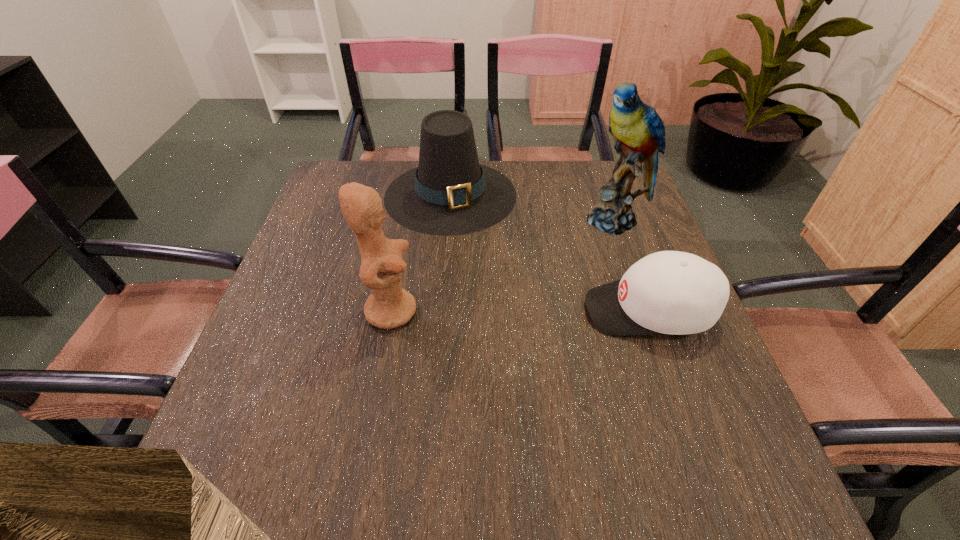
This screenshot has height=540, width=960. In order to click on vacant space located on the face of the parrot in this screenshot , I will do `click(567, 279)`.

Image resolution: width=960 pixels, height=540 pixels. I want to click on free location located on the front-facing side of the third tallest object, so click(x=469, y=261).

Locate an element on the screen. vacant area situated on the front-facing side of the third tallest object is located at coordinates (480, 296).

At what (x,y) coordinates should I click in order to perform the action: click on vacant space situated 0.090m on the front-facing side of the third tallest object. Please return your answer as a coordinate pair (x, y). Looking at the image, I should click on (468, 258).

You are a GUI agent. You are given a task and a screenshot of the screen. Output one action in this format:
    pyautogui.click(x=<x>, y=<y>)
    Task: Click on the parrot located at the far edge
    
    Given the screenshot: What is the action you would take?
    pyautogui.click(x=638, y=131)

The width and height of the screenshot is (960, 540). What are the coordinates of `hat that is at the far edge` in the screenshot? It's located at (449, 193).

This screenshot has width=960, height=540. I want to click on baseball cap that is positioned at the right edge, so click(x=669, y=292).

You are a GUI agent. You are given a task and a screenshot of the screen. Output one action in this format:
    pyautogui.click(x=<x>, y=<y>)
    Task: Click on the parrot located in the right edge section of the desktop
    The image size is (960, 540).
    Given the screenshot: What is the action you would take?
    pyautogui.click(x=638, y=131)

You are a GUI agent. You are given a task and a screenshot of the screen. Output one action in this format:
    pyautogui.click(x=<x>, y=<y>)
    Task: Click on the object that is positioned at the far right corner
    
    Given the screenshot: What is the action you would take?
    pyautogui.click(x=638, y=131)

The image size is (960, 540). In the image, there is a desktop. Find the location of `vacant area at the far edge`. vacant area at the far edge is located at coordinates [571, 180].